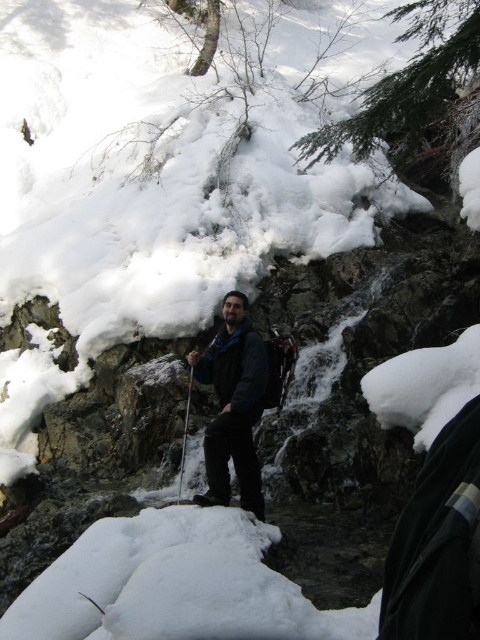
Question: Considering the real-world distances, which object is closest to the reddish-brown wooden ski pole at center?

Choices:
 (A) dark blue jacket at center
 (B) metallic silver ski pole at center

Answer: (B)

Question: Which object is positioned closest to the reddish-brown wooden ski pole at center?

Choices:
 (A) metallic silver ski pole at center
 (B) dark blue jacket at center

Answer: (A)

Question: Does dark blue jacket at center lie behind reddish-brown wooden ski pole at center?

Choices:
 (A) yes
 (B) no

Answer: (B)

Question: Is dark blue jacket at center smaller than metallic silver ski pole at center?

Choices:
 (A) yes
 (B) no

Answer: (B)

Question: Is metallic silver ski pole at center thinner than reddish-brown wooden ski pole at center?

Choices:
 (A) yes
 (B) no

Answer: (A)

Question: Which point is farther from the camera taking this photo?

Choices:
 (A) (244, 452)
 (B) (183, 458)
 (C) (183, 449)

Answer: (C)